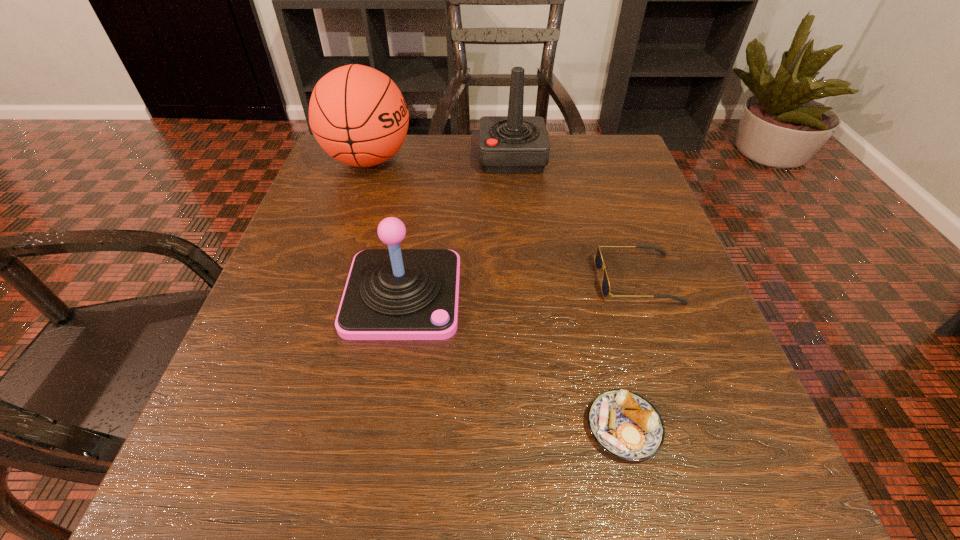
Identify the location of blank space at the near left corner of the desktop. The width and height of the screenshot is (960, 540). click(201, 448).

In order to click on free space at the far right corner of the desktop in this screenshot , I will do `click(603, 161)`.

This screenshot has width=960, height=540. Find the location of `vacant area between the third shortest object and the pastry`. vacant area between the third shortest object and the pastry is located at coordinates (514, 361).

What are the coordinates of `vacant area that lies between the fourth tallest object and the shorter joystick` in the screenshot? It's located at (520, 287).

This screenshot has height=540, width=960. Identify the location of free point between the shortest object and the fourth tallest object. (631, 353).

Locate an element on the screen. The width and height of the screenshot is (960, 540). vacant area between the nearest object and the second shortest object is located at coordinates (631, 353).

Where is `vacant point located between the left joystick and the taller joystick`? This screenshot has height=540, width=960. vacant point located between the left joystick and the taller joystick is located at coordinates (458, 226).

Where is `free space between the third tallest object and the pastry`? free space between the third tallest object and the pastry is located at coordinates pyautogui.click(x=514, y=361).

Identify the location of free area in between the nearer joystick and the taller joystick. (458, 226).

The height and width of the screenshot is (540, 960). What are the coordinates of `empty location between the sunglasses and the farther joystick` in the screenshot? It's located at (575, 218).